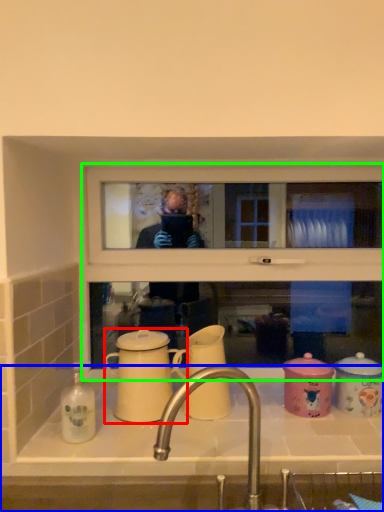
Question: Which is farther away from coffee cup (highlighted by a red box)? sink (highlighted by a blue box) or window frame (highlighted by a green box)?

Choices:
 (A) sink
 (B) window frame

Answer: (B)